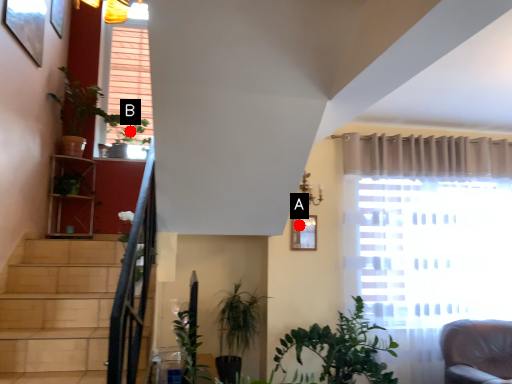
Question: Two points are circled on the image, labeled by A and B beside each circle. Which point is closer to the camera taking this photo?

Choices:
 (A) A is closer
 (B) B is closer

Answer: (A)